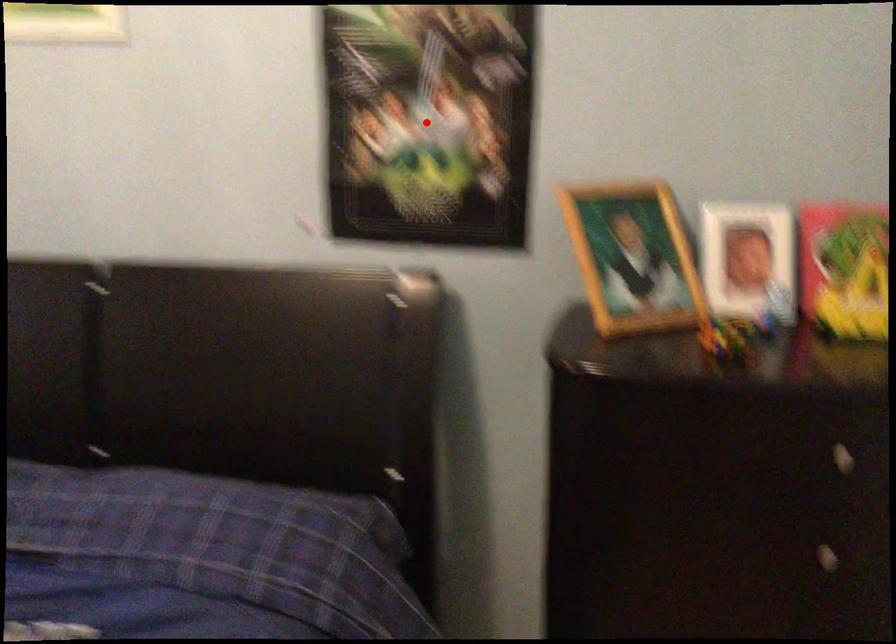
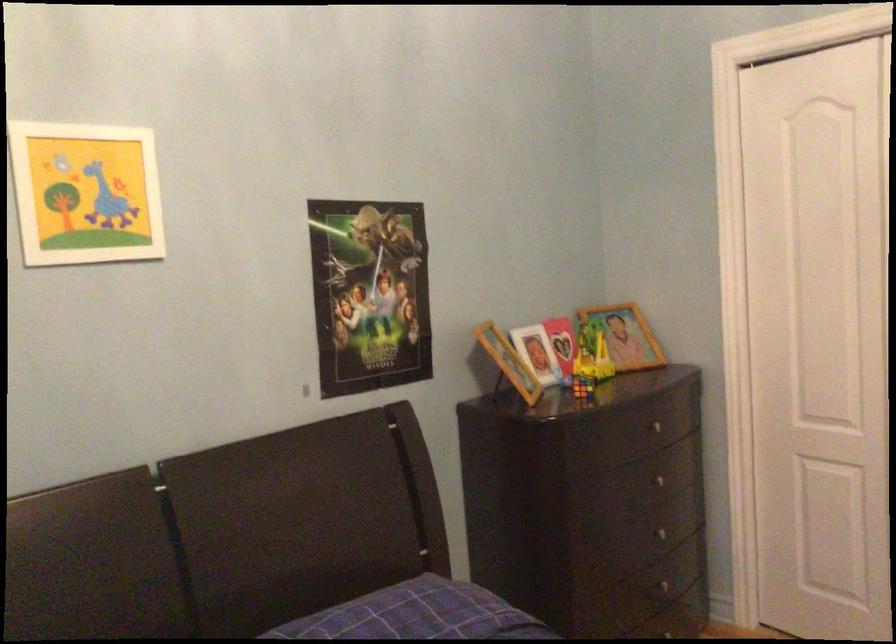
Locate, in the second image, the point that corresponds to the highlighted location in the first image.

(369, 294)